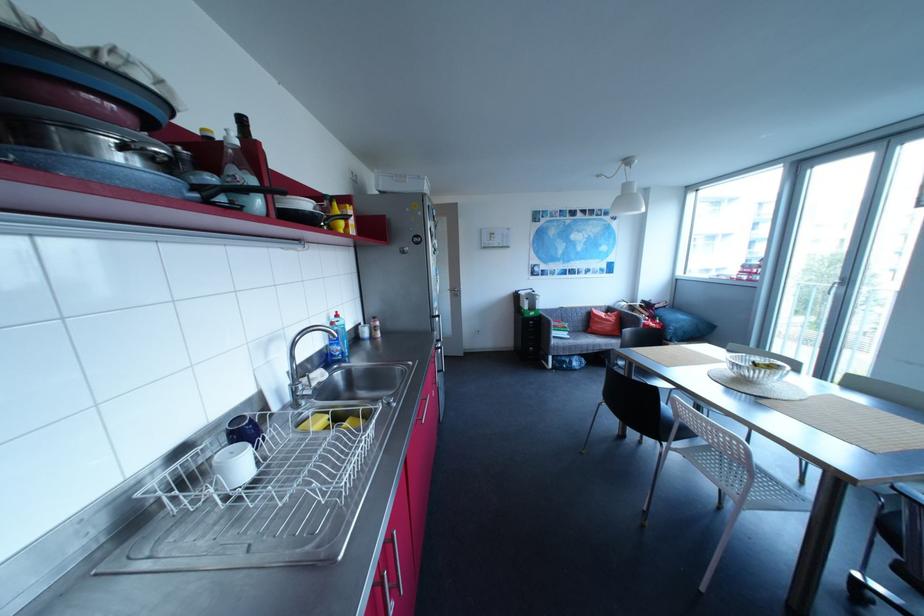
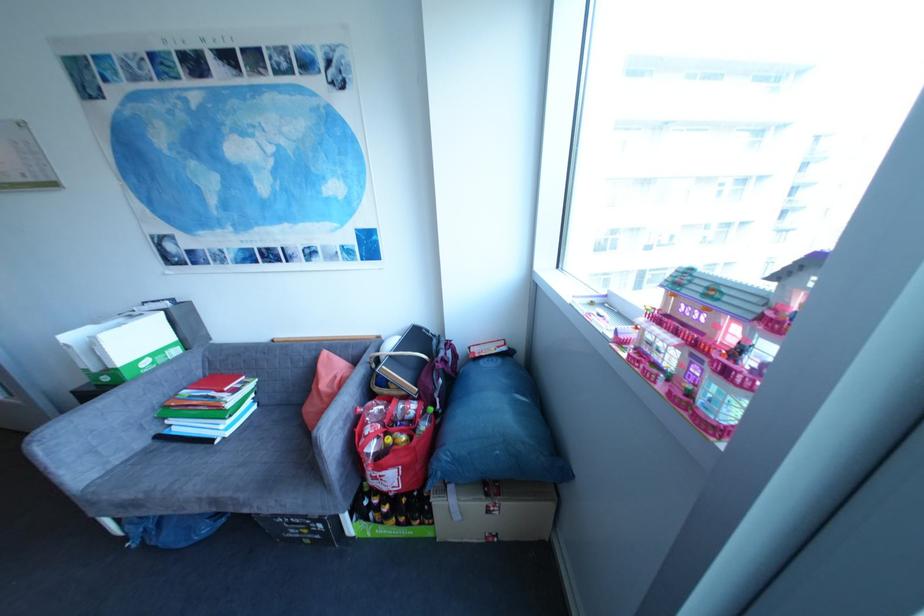
In the scene shown: What movement of the cameraman would produce the second image?

The cameraman walked toward right, forward.